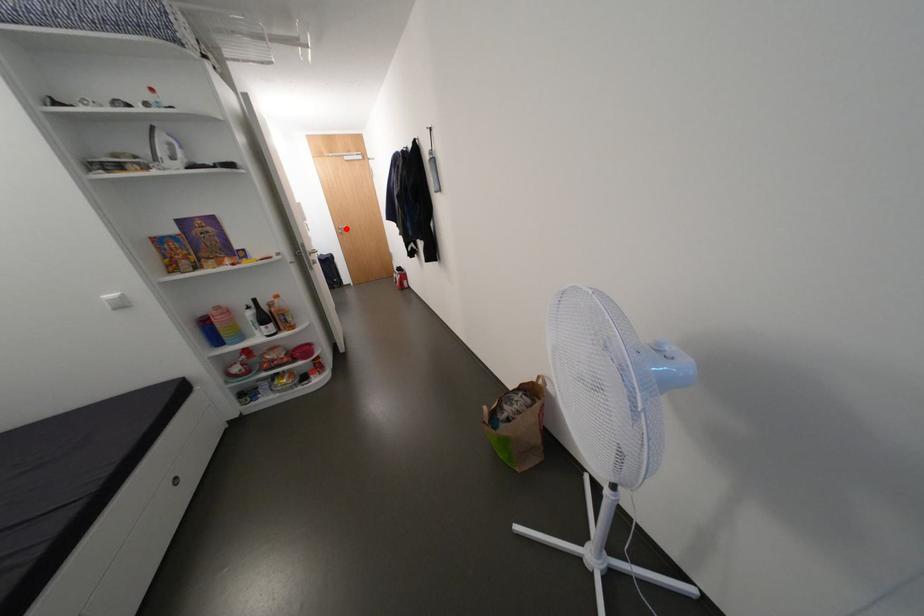
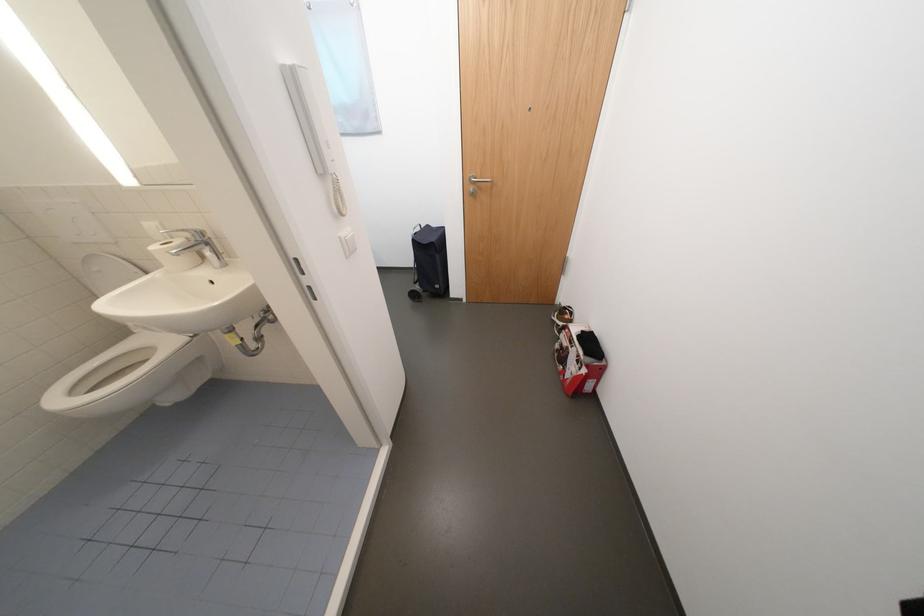
Question: I am providing you with two images of the same scene from different viewpoints. A red point is marked on the first image. At the location where the point appears in image 1, is it still visible in image 2?

Choices:
 (A) Yes
 (B) No

Answer: (A)